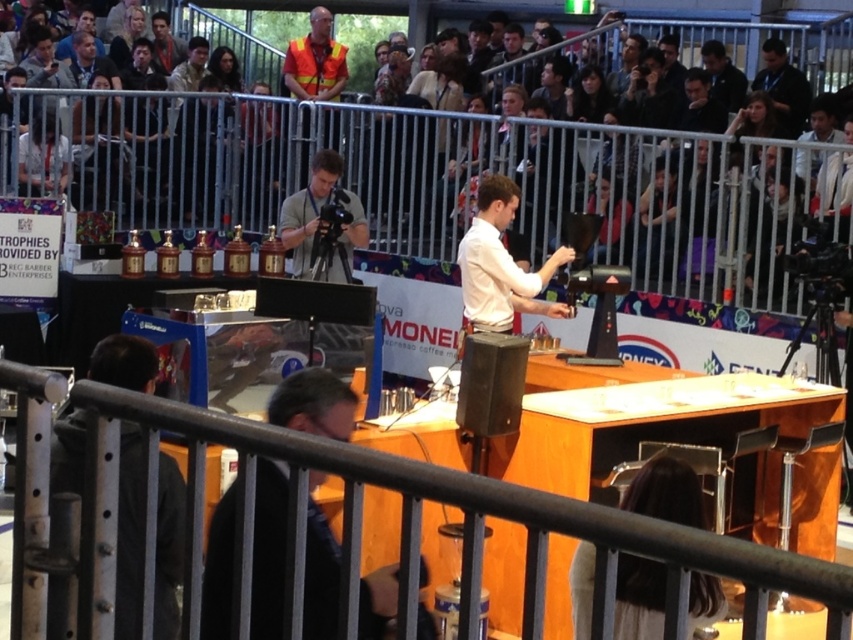
You are a spectator sitting in the tiered seating area. You want to reach the metal at center on the stage. Considering the metal is 2.76 meters away from your current position, can you safely walk to it without any obstacles?

The metal at center is 2.76 meters away from the viewer. Since there are no mentioned obstacles between you and the metal, you can safely walk to it.

Looking at this image, you are a photographer at the event and need to capture a clear photo of the white glossy shirt at center without the dark gray fabric seats at upper center blocking the view. Based on their heights, is this possible?

The dark gray fabric seats at upper center are not as tall as the white glossy shirt at center, so the photographer can capture a clear photo of the white glossy shirt at center without obstruction from the seats.

You are a spectator sitting in the tiered seating at the coffee competition. You want to locate the metal at center on the stage. Based on the coordinates provided, where should you look relative to the stage area?

The metal at center is located at coordinates point 0.787 on the x axis and 0.523 on the y axis relative to the stage area.